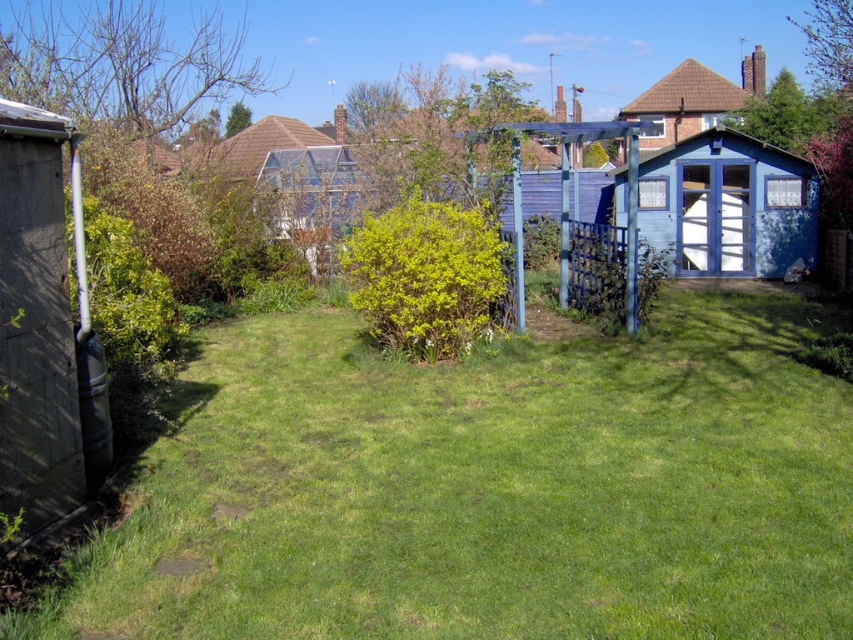
Question: Which object is farther from the camera taking this photo?

Choices:
 (A) brown tiled roof at upper center
 (B) blue painted wood shed at right
 (C) green grass at center

Answer: (A)

Question: Can you confirm if green grass at center is wider than blue painted wood shed at right?

Choices:
 (A) no
 (B) yes

Answer: (A)

Question: Does blue painted wood shed at right appear on the left side of blue wooden shed at upper right?

Choices:
 (A) yes
 (B) no

Answer: (A)

Question: Is green grass at center further to the viewer compared to blue painted wood shed at right?

Choices:
 (A) no
 (B) yes

Answer: (A)

Question: Which object is closer to the camera taking this photo?

Choices:
 (A) blue painted wood shed at right
 (B) green grass at center
 (C) blue wooden shed at upper right

Answer: (B)

Question: Among these points, which one is farthest from the camera?

Choices:
 (A) (207, 152)
 (B) (670, 125)
 (C) (225, 508)
 (D) (720, 244)

Answer: (B)